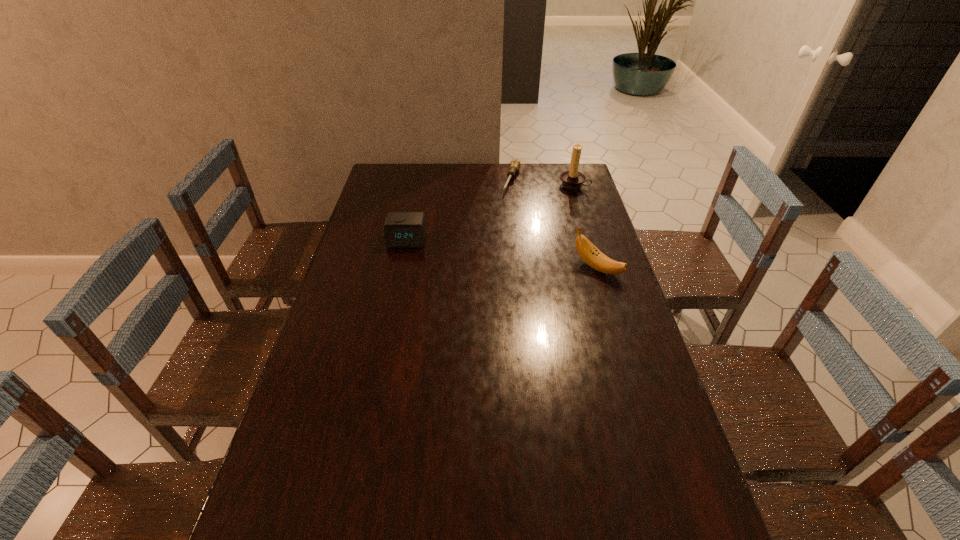
The image size is (960, 540). I want to click on vacant space located 0.200m at the tip of the second object from left to right, so click(498, 221).

Locate an element on the screen. The width and height of the screenshot is (960, 540). vacant space located 0.270m at the tip of the second object from left to right is located at coordinates (493, 232).

At what (x,y) coordinates should I click in order to perform the action: click on vacant space located on the wick of the candle holder. Please return your answer as a coordinate pair (x, y). The image size is (960, 540). Looking at the image, I should click on (521, 226).

Locate an element on the screen. vacant space located 0.080m on the wick of the candle holder is located at coordinates (556, 198).

Identify the location of vacant area situated on the wick of the candle holder. Image resolution: width=960 pixels, height=540 pixels. (524, 223).

This screenshot has height=540, width=960. I want to click on screwdriver located in the far edge section of the desktop, so click(x=514, y=165).

You are a GUI agent. You are given a task and a screenshot of the screen. Output one action in this format:
    pyautogui.click(x=<x>, y=<y>)
    Task: Click on the candle holder that is positioned at the far edge
    
    Given the screenshot: What is the action you would take?
    pyautogui.click(x=573, y=179)

Where is `object that is at the left edge`? This screenshot has height=540, width=960. object that is at the left edge is located at coordinates (402, 229).

This screenshot has height=540, width=960. Find the location of `banana that is at the right edge`. banana that is at the right edge is located at coordinates (591, 255).

Image resolution: width=960 pixels, height=540 pixels. I want to click on candle holder situated at the right edge, so (573, 179).